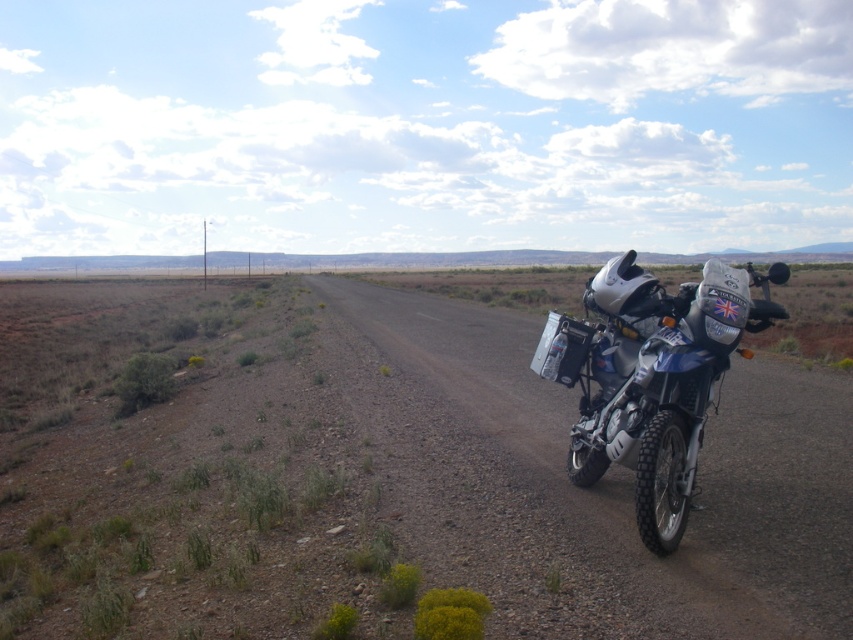
Question: Considering the relative positions of dirt/gravel road at right and metallic blue motorcycle at right in the image provided, where is dirt/gravel road at right located with respect to metallic blue motorcycle at right?

Choices:
 (A) above
 (B) below

Answer: (A)

Question: Where is dirt/gravel road at right located in relation to metallic blue motorcycle at right in the image?

Choices:
 (A) below
 (B) above

Answer: (B)

Question: From the image, what is the correct spatial relationship of dirt/gravel road at right in relation to metallic blue motorcycle at right?

Choices:
 (A) above
 (B) below

Answer: (A)

Question: Which object appears farthest from the camera in this image?

Choices:
 (A) metallic blue motorcycle at right
 (B) dirt/gravel road at right

Answer: (A)

Question: Which of the following is the farthest from the observer?

Choices:
 (A) dirt/gravel road at right
 (B) metallic blue motorcycle at right

Answer: (B)